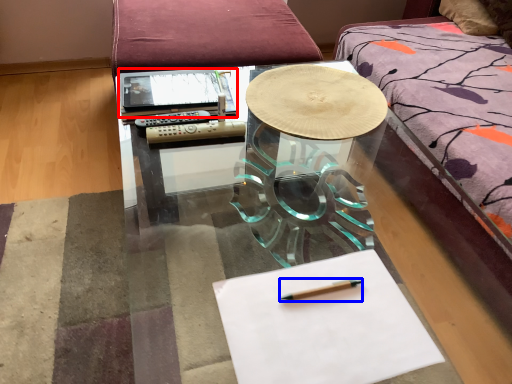
Question: Among these objects, which one is farthest to the camera, notebook (highlighted by a red box) or pencil (highlighted by a blue box)?

Choices:
 (A) notebook
 (B) pencil

Answer: (A)